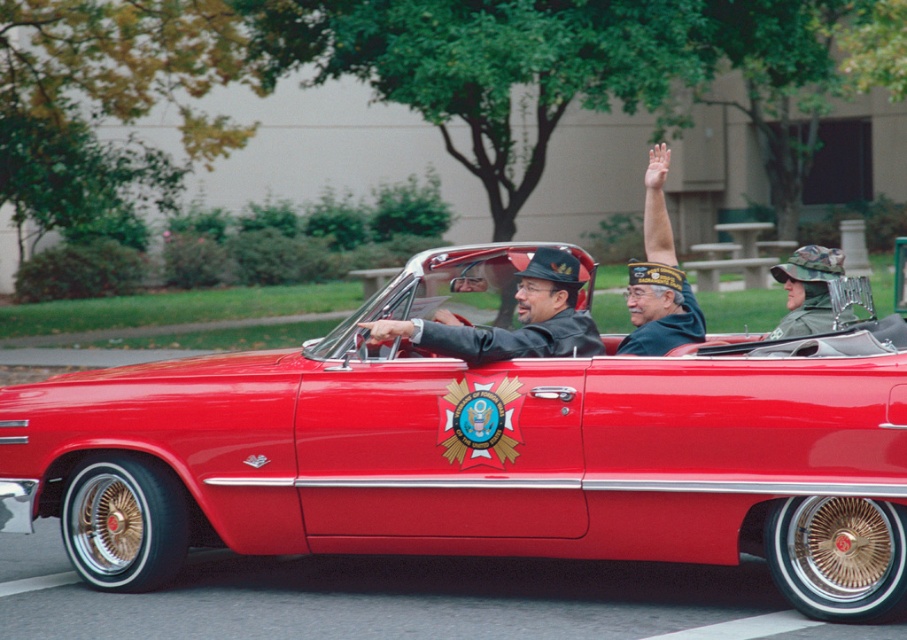
Question: Can you confirm if shiny red car at center is positioned to the left of shiny black hat at center?

Choices:
 (A) no
 (B) yes

Answer: (B)

Question: Among these objects, which one is farthest from the camera?

Choices:
 (A) green felt hat at upper center
 (B) shiny black hat at center
 (C) shiny red car at center

Answer: (A)

Question: Is shiny red car at center closer to camera compared to green felt hat at upper center?

Choices:
 (A) yes
 (B) no

Answer: (A)

Question: Which of the following is the closest to the observer?

Choices:
 (A) green felt hat at upper center
 (B) shiny black hat at center

Answer: (B)

Question: Which point is closer to the camera?

Choices:
 (A) shiny black hat at center
 (B) shiny red car at center
 (C) green felt hat at upper center

Answer: (B)

Question: Can you confirm if shiny red car at center is positioned to the right of shiny black hat at center?

Choices:
 (A) yes
 (B) no

Answer: (B)